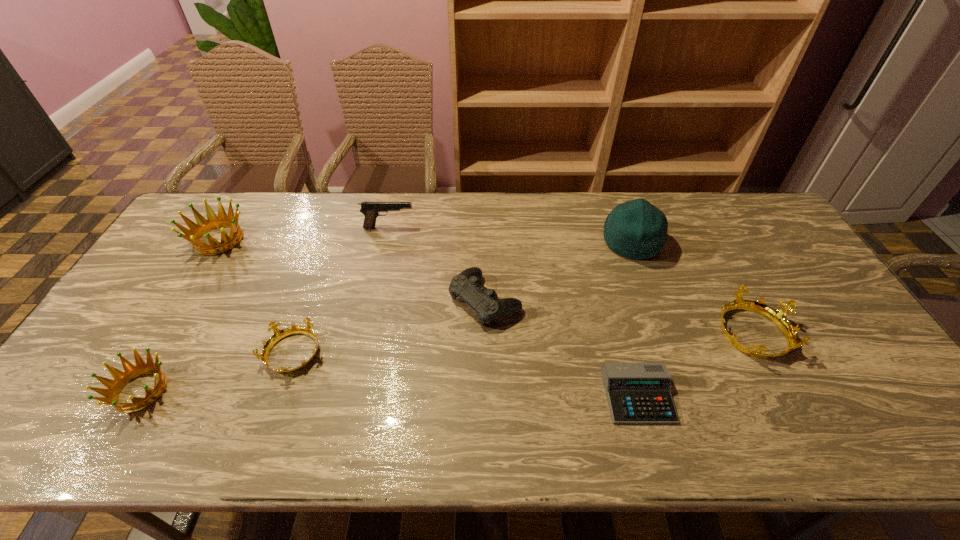
This screenshot has height=540, width=960. In the image, there is a desktop. In order to click on vacant area at the left edge in this screenshot , I will do `click(141, 313)`.

In the image, there is a desktop. Identify the location of vacant region at the right edge. The height and width of the screenshot is (540, 960). (791, 280).

Image resolution: width=960 pixels, height=540 pixels. I want to click on free space between the beanie and the fifth object from left to right, so click(559, 271).

Find the location of `free spot between the calculator and the smaller golden crown`. free spot between the calculator and the smaller golden crown is located at coordinates (390, 394).

The image size is (960, 540). Find the location of `vacant area that lies between the smaller golden crown and the fourth object from right to left`. vacant area that lies between the smaller golden crown and the fourth object from right to left is located at coordinates (313, 346).

At what (x,y) coordinates should I click in order to perform the action: click on free space that is in between the shortest object and the rightmost crown. Please return your answer as a coordinate pair (x, y). The height and width of the screenshot is (540, 960). Looking at the image, I should click on pos(694,364).

In order to click on vacant area that lies between the smaller gold crown and the tallest crown in this screenshot , I will do `click(256, 297)`.

Where is `vacant area between the right gold crown and the fifth object from left to right`? The width and height of the screenshot is (960, 540). vacant area between the right gold crown and the fifth object from left to right is located at coordinates (618, 316).

The width and height of the screenshot is (960, 540). I want to click on free space between the smaller golden crown and the beanie, so click(x=387, y=316).

Locate an element on the screen. The image size is (960, 540). empty location between the calculator and the farther golden crown is located at coordinates pyautogui.click(x=428, y=318).